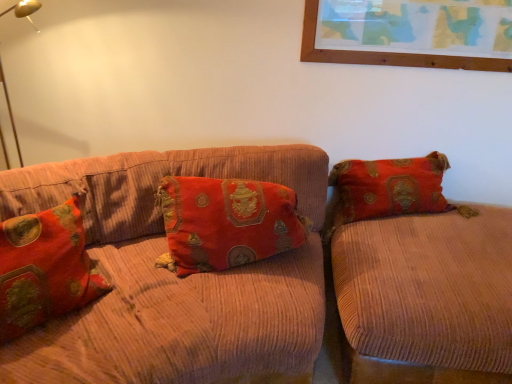
Question: Should I look upward or downward to see velvet orange couch at right, which appears as the 1th studio couch when viewed from the right?

Choices:
 (A) down
 (B) up

Answer: (A)

Question: Which direction should I rotate to look at velvet-like red pillow at center, the second pillow positioned from the left?

Choices:
 (A) right
 (B) left

Answer: (B)

Question: Is velvet-like red pillow at left, which is the 1th pillow in left-to-right order, to the right of corduroy couch at center, which is counted as the first studio couch, starting from the left, from the viewer's perspective?

Choices:
 (A) no
 (B) yes

Answer: (A)

Question: Is velvet-like red pillow at left, which is the 1th pillow in left-to-right order, behind corduroy couch at center, the 2th studio couch positioned from the right?

Choices:
 (A) no
 (B) yes

Answer: (A)

Question: Can you confirm if velvet-like red pillow at left, which is the 1th pillow in left-to-right order, is positioned to the left of corduroy couch at center, which is counted as the first studio couch, starting from the left?

Choices:
 (A) no
 (B) yes

Answer: (B)

Question: Would you say velvet-like red pillow at left, the 2th pillow viewed from the right, is a long distance from corduroy couch at center, which is counted as the first studio couch, starting from the left?

Choices:
 (A) no
 (B) yes

Answer: (A)

Question: From a real-world perspective, is velvet-like red pillow at left, which is the 1th pillow in left-to-right order, located higher than corduroy couch at center, which is counted as the first studio couch, starting from the left?

Choices:
 (A) yes
 (B) no

Answer: (A)

Question: Is velvet-like red pillow at left, the 2th pillow viewed from the right, oriented away from corduroy couch at center, the 2th studio couch positioned from the right?

Choices:
 (A) yes
 (B) no

Answer: (A)

Question: From the image's perspective, is corduroy couch at center, the 2th studio couch positioned from the right, on top of velvet-like red pillow at center, which appears as the 1th pillow when viewed from the right?

Choices:
 (A) yes
 (B) no

Answer: (B)

Question: Is corduroy couch at center, the 2th studio couch positioned from the right, wider than velvet-like red pillow at center, the second pillow positioned from the left?

Choices:
 (A) no
 (B) yes

Answer: (B)

Question: Is corduroy couch at center, the 2th studio couch positioned from the right, bigger than velvet-like red pillow at center, the second pillow positioned from the left?

Choices:
 (A) no
 (B) yes

Answer: (B)

Question: Can velvet-like red pillow at center, the second pillow positioned from the left, be found inside corduroy couch at center, the 2th studio couch positioned from the right?

Choices:
 (A) yes
 (B) no

Answer: (A)

Question: Does corduroy couch at center, the 2th studio couch positioned from the right, come behind velvet-like red pillow at center, which appears as the 1th pillow when viewed from the right?

Choices:
 (A) no
 (B) yes

Answer: (A)

Question: From a real-world perspective, is corduroy couch at center, the 2th studio couch positioned from the right, located higher than velvet-like red pillow at center, the second pillow positioned from the left?

Choices:
 (A) no
 (B) yes

Answer: (A)

Question: Is velvet orange couch at right, which appears as the 1th studio couch when viewed from the right, bigger than velvet-like red pillow at left, which is the 1th pillow in left-to-right order?

Choices:
 (A) no
 (B) yes

Answer: (B)